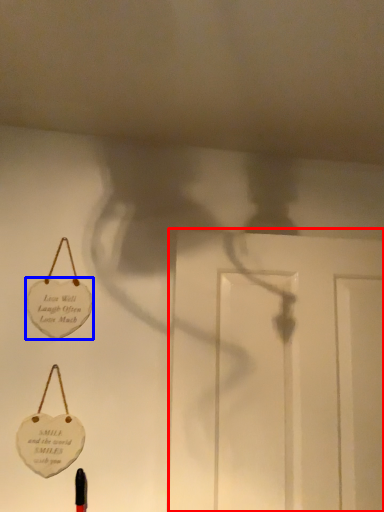
Question: Which point is further to the camera, door (highlighted by a red box) or badge (highlighted by a blue box)?

Choices:
 (A) door
 (B) badge

Answer: (B)